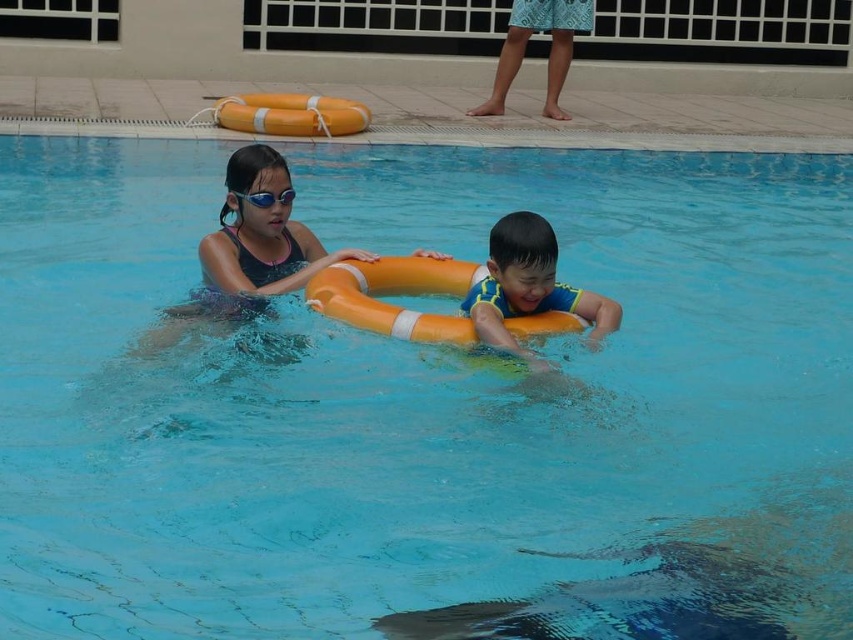
Can you confirm if matte black swimsuit at center is positioned to the left of yellow foam ring at center?

Correct, you'll find matte black swimsuit at center to the left of yellow foam ring at center.

Identify the location of matte black swimsuit at center. (247, 253).

Does yellow foam ring at center lie behind transparent plastic goggles at upper center?

That is False.

How distant is yellow foam ring at center from transparent plastic goggles at upper center?

A distance of 4.16 feet exists between yellow foam ring at center and transparent plastic goggles at upper center.

Where is `yellow foam ring at center`? yellow foam ring at center is located at coordinates 527,285.

How much distance is there between matte black swimsuit at center and transparent plastic goggles at upper center?

matte black swimsuit at center and transparent plastic goggles at upper center are 34.39 centimeters apart from each other.

From the picture: Does matte black swimsuit at center appear on the right side of transparent plastic goggles at upper center?

Incorrect, matte black swimsuit at center is not on the right side of transparent plastic goggles at upper center.

The height and width of the screenshot is (640, 853). Identify the location of matte black swimsuit at center. (247, 253).

This screenshot has height=640, width=853. In order to click on matte black swimsuit at center in this screenshot , I will do `click(247, 253)`.